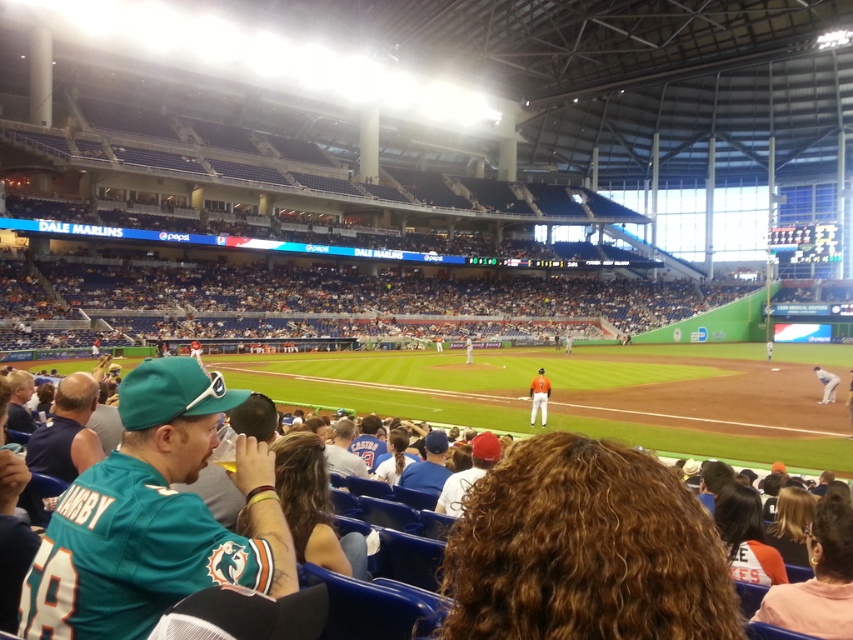
You are a photographer standing at the center of the stadium field. You want to take a photo of the white jersey at right. Which direction should you move to get the best shot?

The white jersey at right is located at point 0.602 on the x axis and 0.970 on the y axis. Since you are at the center, you should move to the right and slightly forward to align with the jersey for the best shot.

You are a photographer trying to capture a clear shot of both the orange jersey at center and the white jersey at right. Considering their sizes, which jersey should you focus on first to ensure it fits within your camera frame?

The orange jersey at center is larger in size than the white jersey at right. To ensure both fit in the frame, focus on the orange jersey at center first since it requires more space, then adjust for the smaller white jersey at right.

You are standing at the point marked by the coordinates point [540,412] in the baseball stadium. A drone is flying above the field and needs to land at your location. What is the horizontal distance the drone must cover to reach you?

The point [540,412] is 24.95 meters away from the viewer, so the drone must cover a horizontal distance of 24.95 meters to land at that point.